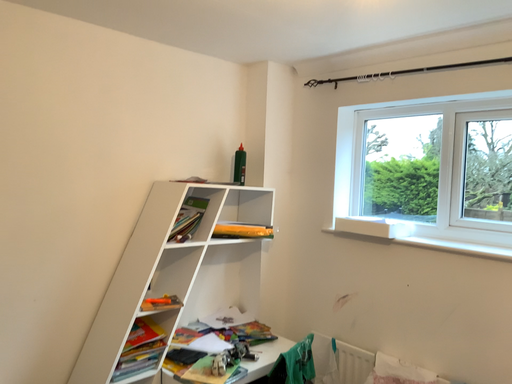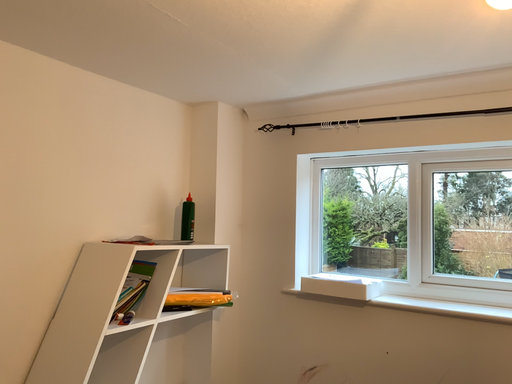
Question: Which way did the camera rotate in the video?

Choices:
 (A) rotated left
 (B) rotated right

Answer: (B)